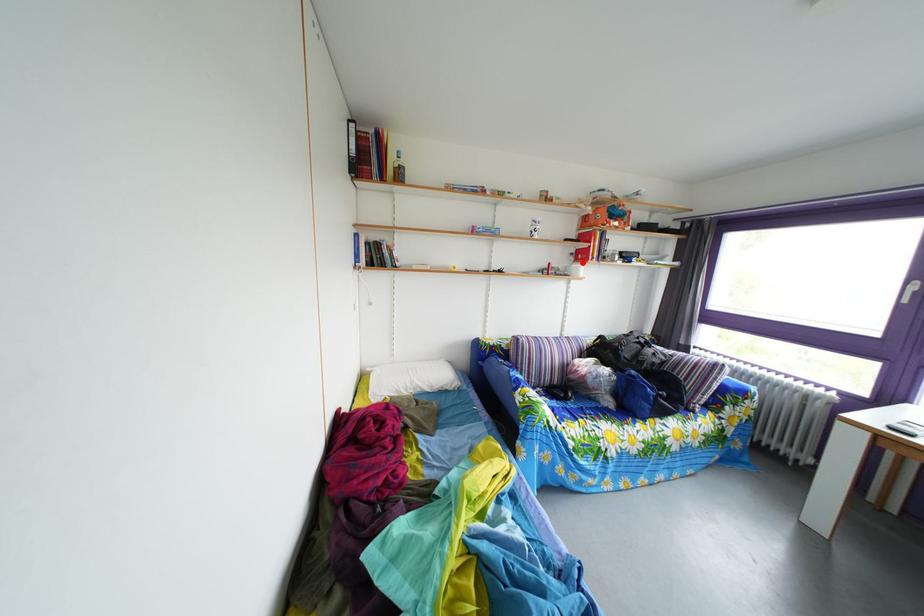
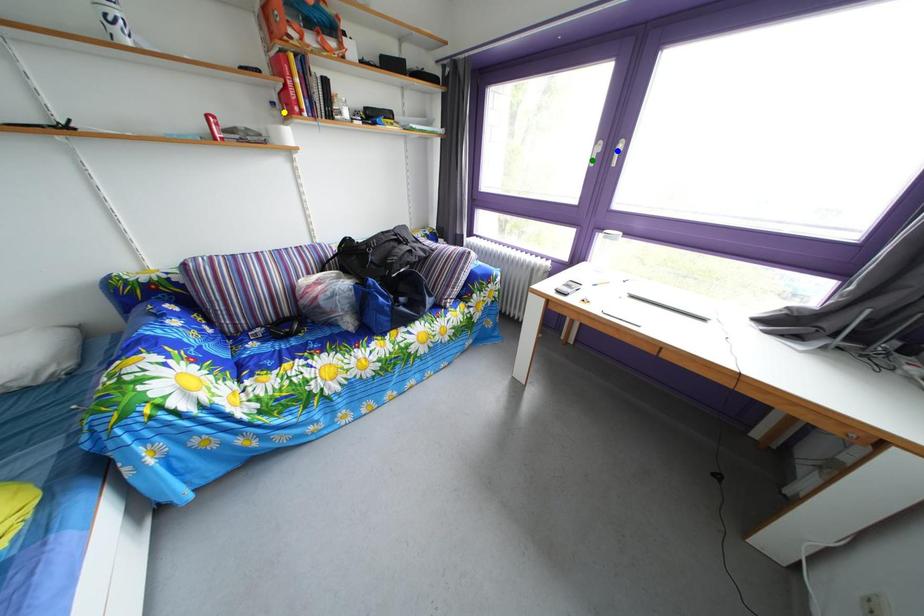
Question: I am providing you with two images of the same scene from different viewpoints. A red point is marked on the first image. You are given multiple points on the second image. Which spot in image 2 lines up with the point in image 1?

Choices:
 (A) green point
 (B) blue point
 (C) yellow point

Answer: (C)